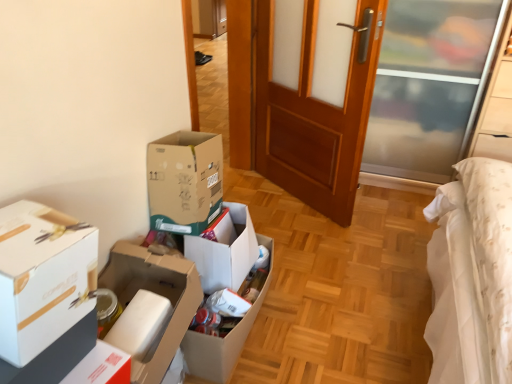
Where is `vacant space in front of wooden door at center`? The height and width of the screenshot is (384, 512). vacant space in front of wooden door at center is located at coordinates (320, 242).